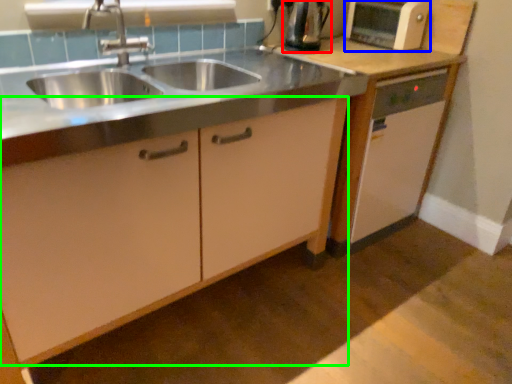
Question: Considering the real-world distances, which object is closest to kitchen appliance (highlighted by a red box)? home appliance (highlighted by a blue box) or cabinetry (highlighted by a green box).

Choices:
 (A) home appliance
 (B) cabinetry

Answer: (A)